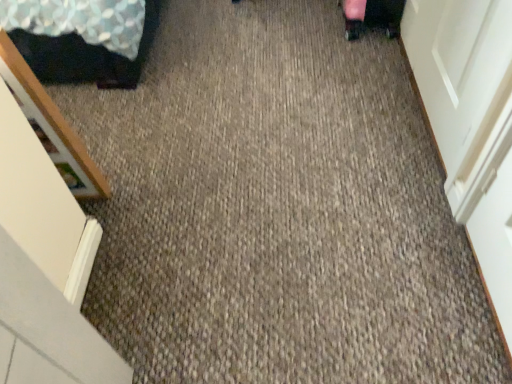
I want to click on white smooth door at right, so click(x=460, y=71).

What do you see at coordinates (460, 71) in the screenshot?
I see `white smooth door at right` at bounding box center [460, 71].

Locate an element on the screen. white smooth door at right is located at coordinates (460, 71).